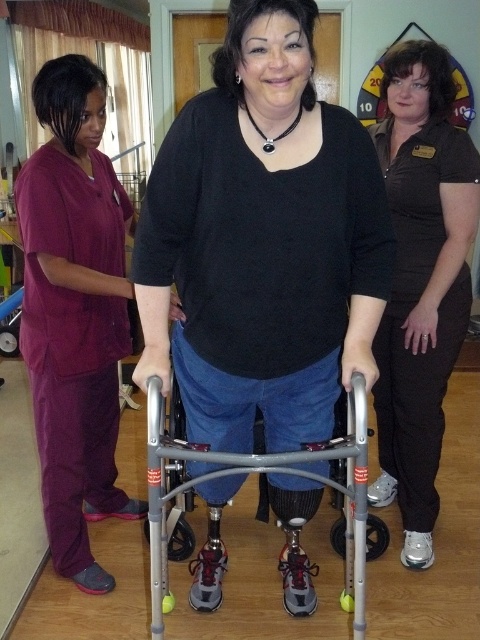
You are a physical therapist assessing the setup for a patient who uses a walker. The scene shows a black matte walker at center and a maroon scrubs at left. Based on the height of the objects, which one is shorter?

The black matte walker at center is shorter than the maroon scrubs at left.

You are a physical therapist working with a patient who uses a walker. The patient is wearing black matte pants at center and using a black matte walker at center. You need to adjust the walker so that it is closer to the patient. Currently, the distance between them is 29.10 inches. What is the minimum distance you should set between the walker and the patient to ensure proper usage?

The distance between the black matte walker at center and black matte pants at center should be adjusted to no more than 29.10 inches to ensure proper usage.